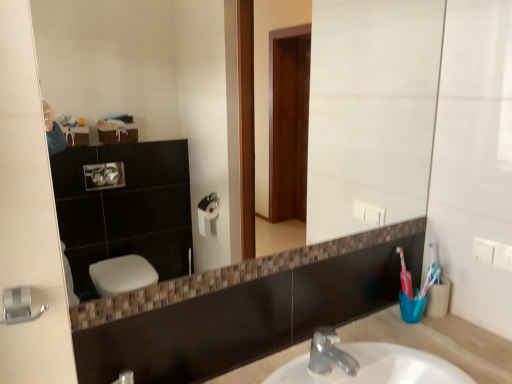
Find the location of a particular element. The image size is (512, 384). beige marble sink at center is located at coordinates (440, 342).

What do you see at coordinates (440, 342) in the screenshot?
I see `beige marble sink at center` at bounding box center [440, 342].

What do you see at coordinates (147, 83) in the screenshot? I see `matte glass mirror at center` at bounding box center [147, 83].

Find the location of a particular element. matte glass mirror at center is located at coordinates (147, 83).

Measure the distance between point (x=95, y=69) and camera.

Point (x=95, y=69) and camera are 30.39 inches apart from each other.

Locate an element on the screen. beige marble sink at center is located at coordinates (440, 342).

Visually, is matte glass mirror at center positioned to the left or to the right of beige marble sink at center?

In the image, matte glass mirror at center appears on the left side of beige marble sink at center.

Consider the image. Is matte glass mirror at center closer to camera compared to beige marble sink at center?

Yes.

Is point (368, 107) closer to camera compared to point (366, 318)?

No, it is behind (366, 318).

From the image's perspective, which object appears higher, matte glass mirror at center or beige marble sink at center?

matte glass mirror at center, from the image's perspective.

From a real-world perspective, relative to beige marble sink at center, is matte glass mirror at center vertically above or below?

From a real-world perspective, matte glass mirror at center is physically above beige marble sink at center.

Does matte glass mirror at center have a lesser width compared to beige marble sink at center?

Yes, matte glass mirror at center is thinner than beige marble sink at center.

Consider the image. In terms of height, does matte glass mirror at center look taller or shorter compared to beige marble sink at center?

matte glass mirror at center is taller than beige marble sink at center.

In the scene shown: Which of these two, matte glass mirror at center or beige marble sink at center, is smaller?

With smaller size is beige marble sink at center.

Is matte glass mirror at center situated inside beige marble sink at center or outside?

matte glass mirror at center exists outside the volume of beige marble sink at center.

From the picture: Can you see matte glass mirror at center touching beige marble sink at center?

No.

Is matte glass mirror at center turned away from beige marble sink at center?

matte glass mirror at center is not turned away from beige marble sink at center.

How distant is matte glass mirror at center from beige marble sink at center?

The distance of matte glass mirror at center from beige marble sink at center is 22.63 inches.

The image size is (512, 384). Find the location of `counter top behind the matte glass mirror at center`. counter top behind the matte glass mirror at center is located at coordinates (440, 342).

Which object is positioned more to the right, beige marble sink at center or matte glass mirror at center?

beige marble sink at center is more to the right.

Relative to matte glass mirror at center, is beige marble sink at center in front or behind?

Visually, beige marble sink at center is located behind matte glass mirror at center.

Is point (264, 364) farther from camera compared to point (395, 202)?

No, (264, 364) is in front of (395, 202).

From the image's perspective, who appears lower, beige marble sink at center or matte glass mirror at center?

beige marble sink at center.

From a real-world perspective, which object rests below the other?

beige marble sink at center.

From the picture: Considering the relative sizes of beige marble sink at center and matte glass mirror at center in the image provided, is beige marble sink at center thinner than matte glass mirror at center?

Incorrect, the width of beige marble sink at center is not less than that of matte glass mirror at center.

Between beige marble sink at center and matte glass mirror at center, which one has less height?

With less height is beige marble sink at center.

Does beige marble sink at center have a smaller size compared to matte glass mirror at center?

Correct, beige marble sink at center occupies less space than matte glass mirror at center.

Looking at this image, is beige marble sink at center positioned beyond the bounds of matte glass mirror at center?

Yes, beige marble sink at center is not within matte glass mirror at center.

Are beige marble sink at center and matte glass mirror at center making contact?

beige marble sink at center and matte glass mirror at center are not in contact.

Is beige marble sink at center aimed at matte glass mirror at center?

No, beige marble sink at center is not facing towards matte glass mirror at center.

Can you tell me how much beige marble sink at center and matte glass mirror at center differ in facing direction?

The facing directions of beige marble sink at center and matte glass mirror at center are 0.0847 degrees apart.

Where is `mirror positioned vertically above the beige marble sink at center (from a real-world perspective)`? Image resolution: width=512 pixels, height=384 pixels. mirror positioned vertically above the beige marble sink at center (from a real-world perspective) is located at coordinates (147, 83).

Image resolution: width=512 pixels, height=384 pixels. Identify the location of mirror above the beige marble sink at center (from the image's perspective). (147, 83).

In the image, there is a matte glass mirror at center. Where is `counter top below it (from the image's perspective)`? Image resolution: width=512 pixels, height=384 pixels. counter top below it (from the image's perspective) is located at coordinates (440, 342).